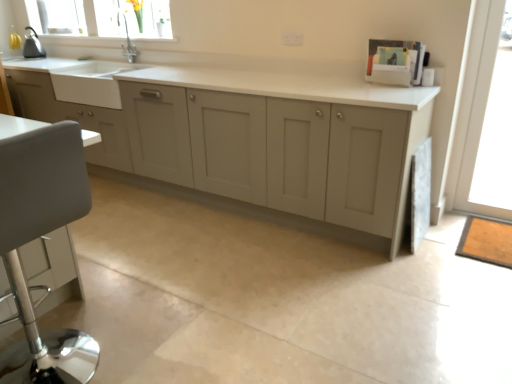
The image size is (512, 384). What do you see at coordinates (40, 236) in the screenshot? I see `white leather swivel chair at left` at bounding box center [40, 236].

I want to click on clear glass window at upper left, so click(x=57, y=16).

The image size is (512, 384). What are the coordinates of `matte gray cabinets at center` in the screenshot? It's located at (245, 134).

What do you see at coordinates (90, 83) in the screenshot? This screenshot has width=512, height=384. I see `white matte sink at left` at bounding box center [90, 83].

Describe the element at coordinates (33, 46) in the screenshot. I see `metallic gray kettle at upper left` at that location.

At what (x,y) coordinates should I click in order to perform the action: click on transparent glass door at right. Please return your answer as a coordinate pair (x, y). This screenshot has height=384, width=512. Looking at the image, I should click on coord(474,107).

The image size is (512, 384). Describe the element at coordinates (474, 107) in the screenshot. I see `transparent glass door at right` at that location.

Identify the location of white leather swivel chair at left. (40, 236).

Looking at this image, between transparent glass door at right and matte gray cabinets at center, which one has less height?

Standing shorter between the two is matte gray cabinets at center.

How far apart are transparent glass door at right and matte gray cabinets at center?

transparent glass door at right and matte gray cabinets at center are 1.42 meters apart from each other.

Is transparent glass door at right outside of matte gray cabinets at center?

Yes, transparent glass door at right is not within matte gray cabinets at center.

Is there a large distance between transparent glass door at right and matte gray cabinets at center?

Indeed, transparent glass door at right is not near matte gray cabinets at center.

Is white matte sink at left touching metallic gray kettle at upper left?

white matte sink at left is not next to metallic gray kettle at upper left, and they're not touching.

Considering the relative sizes of white matte sink at left and metallic gray kettle at upper left in the image provided, is white matte sink at left taller than metallic gray kettle at upper left?

Incorrect, the height of white matte sink at left is not larger of that of metallic gray kettle at upper left.

Between point (59, 70) and point (26, 36), which one is positioned in front?

Point (59, 70)

From the picture: Does white matte sink at left have a smaller size compared to metallic gray kettle at upper left?

No.

From the image's perspective, does matte gray cabinets at center appear lower than white leather swivel chair at left?

No.

Is matte gray cabinets at center turned away from white leather swivel chair at left?

matte gray cabinets at center does not have its back to white leather swivel chair at left.

Considering the relative sizes of matte gray cabinets at center and white leather swivel chair at left in the image provided, is matte gray cabinets at center thinner than white leather swivel chair at left?

Incorrect, the width of matte gray cabinets at center is not less than that of white leather swivel chair at left.

Does point (132, 122) come farther from viewer compared to point (69, 214)?

Yes.

Consider the image. Are clear glass window at upper left and matte gray cabinets at center far apart?

clear glass window at upper left is positioned a significant distance from matte gray cabinets at center.

Considering the relative positions of clear glass window at upper left and matte gray cabinets at center in the image provided, is clear glass window at upper left in front of matte gray cabinets at center?

No, clear glass window at upper left is further to the viewer.

Considering the points (77, 21) and (61, 64), which point is in front, point (77, 21) or point (61, 64)?

Point (61, 64)

Is metallic gray kettle at upper left taller than white matte sink at left?

Yes.

The height and width of the screenshot is (384, 512). What are the coordinates of `appliance behind the white matte sink at left` in the screenshot? It's located at point(33,46).

Is metallic gray kettle at upper left positioned beyond the bounds of white matte sink at left?

Yes, metallic gray kettle at upper left is not within white matte sink at left.

How far apart are transparent glass door at right and white leather swivel chair at left?

A distance of 7.95 feet exists between transparent glass door at right and white leather swivel chair at left.

In the image, is transparent glass door at right on the left side or the right side of white leather swivel chair at left?

transparent glass door at right is positioned on white leather swivel chair at left's right side.

Is transparent glass door at right with white leather swivel chair at left?

No, transparent glass door at right is not next to white leather swivel chair at left.

At what (x,y) coordinates should I click in order to perform the action: click on window screen located behind the white leather swivel chair at left. Please return your answer as a coordinate pair (x, y). The height and width of the screenshot is (384, 512). Looking at the image, I should click on (474, 107).

Is clear glass window at upper left beside metallic gray kettle at upper left?

clear glass window at upper left is not next to metallic gray kettle at upper left, and they're not touching.

Who is more distant, clear glass window at upper left or metallic gray kettle at upper left?

Positioned behind is clear glass window at upper left.

From the image's perspective, does clear glass window at upper left appear lower than metallic gray kettle at upper left?

Incorrect, from the image's perspective, clear glass window at upper left is higher than metallic gray kettle at upper left.

Is clear glass window at upper left taller than metallic gray kettle at upper left?

Yes, clear glass window at upper left is taller than metallic gray kettle at upper left.

Identify the location of cabinetry above the transparent glass door at right (from the image's perspective). (245, 134).

This screenshot has width=512, height=384. Identify the location of appliance that appears above the white matte sink at left (from a real-world perspective). (33, 46).

When comparing their distances from white leather swivel chair at left, does transparent glass door at right or metallic gray kettle at upper left seem further?

metallic gray kettle at upper left lies further to white leather swivel chair at left than the other object.

Based on their spatial positions, is clear glass window at upper left or matte gray cabinets at center further from white leather swivel chair at left?

clear glass window at upper left is further to white leather swivel chair at left.

Estimate the real-world distances between objects in this image. Which object is further from transparent glass door at right, metallic gray kettle at upper left or white matte sink at left?

Based on the image, metallic gray kettle at upper left appears to be further to transparent glass door at right.

Considering their positions, is metallic gray kettle at upper left positioned further to white leather swivel chair at left than white matte sink at left?

metallic gray kettle at upper left lies further to white leather swivel chair at left than the other object.

Estimate the real-world distances between objects in this image. Which object is closer to white matte sink at left, metallic gray kettle at upper left or clear glass window at upper left?

clear glass window at upper left lies closer to white matte sink at left than the other object.

From the image, which object appears to be nearer to clear glass window at upper left, transparent glass door at right or metallic gray kettle at upper left?

metallic gray kettle at upper left is closer to clear glass window at upper left.

When comparing their distances from transparent glass door at right, does clear glass window at upper left or white leather swivel chair at left seem further?

clear glass window at upper left lies further to transparent glass door at right than the other object.

From the image, which object appears to be nearer to white matte sink at left, white leather swivel chair at left or metallic gray kettle at upper left?

Based on the image, metallic gray kettle at upper left appears to be nearer to white matte sink at left.

What are the coordinates of `window between metallic gray kettle at upper left and transparent glass door at right in the horizontal direction` in the screenshot? It's located at (57, 16).

Find the location of a particular element. sink between metallic gray kettle at upper left and transparent glass door at right from left to right is located at coordinates (90, 83).

In order to click on swivel chair between clear glass window at upper left and transparent glass door at right from left to right in this screenshot , I will do `click(40, 236)`.

Where is `swivel chair between metallic gray kettle at upper left and transparent glass door at right`? The height and width of the screenshot is (384, 512). swivel chair between metallic gray kettle at upper left and transparent glass door at right is located at coordinates (40, 236).